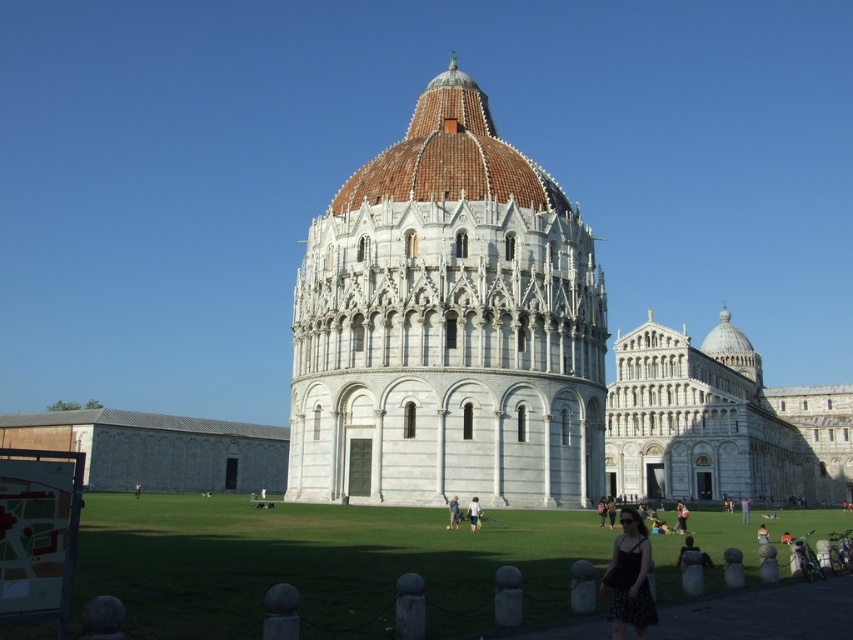
Which is in front, point (397, 474) or point (701, 556)?

Positioned in front is point (701, 556).

I want to click on white marble tower at center, so click(448, 324).

At what (x,y) coordinates should I click in order to perform the action: click on white marble tower at center. Please return your answer as a coordinate pair (x, y). Looking at the image, I should click on (448, 324).

What do you see at coordinates (473, 513) in the screenshot? I see `light blue denim shorts at center` at bounding box center [473, 513].

Between light blue denim shorts at center and light brown leather jacket at center, which one is positioned higher?

Positioned higher is light blue denim shorts at center.

Where is `light blue denim shorts at center`? light blue denim shorts at center is located at coordinates (473, 513).

Consider the image. Which is above, white marble tower at center or brown tiled dome at center?

brown tiled dome at center is higher up.

Does point (531, 193) come farther from viewer compared to point (433, 80)?

No, it is in front of (433, 80).

You are a GUI agent. You are given a task and a screenshot of the screen. Output one action in this format:
    pyautogui.click(x=<x>, y=<y>)
    Task: Click on the white marble tower at center
    The width and height of the screenshot is (853, 640).
    Given the screenshot: What is the action you would take?
    pyautogui.click(x=448, y=324)